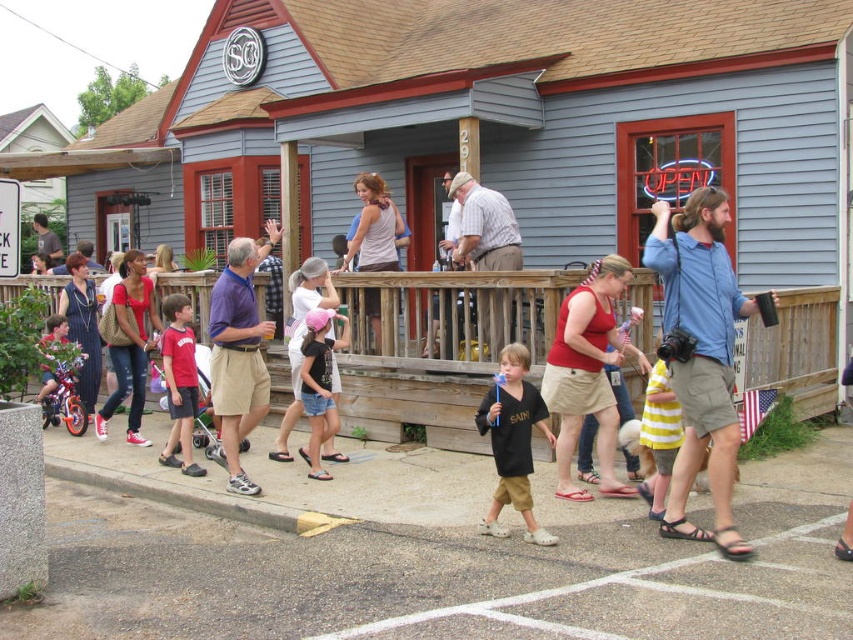
Is wooden at center wider than denim jeans at center?

Incorrect, wooden at center's width does not surpass denim jeans at center's.

Which is more to the left, wooden at center or denim jeans at center?

Positioned to the left is denim jeans at center.

What are the coordinates of `wooden at center` in the screenshot? It's located at (436, 358).

Between black matte shirt at center and denim jeans at center, which one has less height?

Standing shorter between the two is black matte shirt at center.

Measure the distance between black matte shirt at center and denim jeans at center.

Answer: black matte shirt at center is 4.58 meters away from denim jeans at center.

Does point (509, 502) come behind point (122, 264)?

No, it is in front of (122, 264).

I want to click on black matte shirt at center, so click(514, 440).

Is denim jeans at center shorter than white painted line at lower center?

Incorrect, denim jeans at center's height does not fall short of white painted line at lower center's.

Between denim jeans at center and white painted line at lower center, which one has less height?

white painted line at lower center

Is point (103, 433) in front of point (842, 515)?

That is False.

At what (x,y) coordinates should I click in order to perform the action: click on denim jeans at center. Please return your answer as a coordinate pair (x, y). The image size is (853, 640). Looking at the image, I should click on point(131,344).